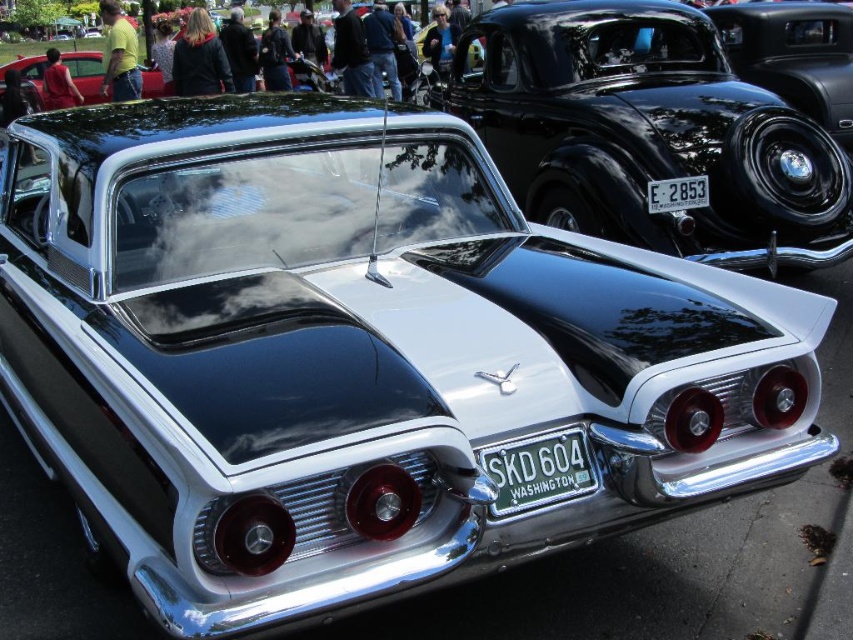
Question: Where is shiny black car at upper right located in relation to white plastic license plate at center in the image?

Choices:
 (A) below
 (B) above

Answer: (B)

Question: Can you confirm if green metallic license plate at center is smaller than white plastic license plate at center?

Choices:
 (A) no
 (B) yes

Answer: (A)

Question: Among these objects, which one is nearest to the camera?

Choices:
 (A) green metallic license plate at center
 (B) white plastic license plate at center
 (C) shiny black car at upper right

Answer: (A)

Question: Among these points, which one is nearest to the camera?

Choices:
 (A) (519, 460)
 (B) (682, 205)

Answer: (A)

Question: Which point appears closest to the camera in this image?

Choices:
 (A) pyautogui.click(x=538, y=449)
 (B) pyautogui.click(x=662, y=200)
 (C) pyautogui.click(x=668, y=72)

Answer: (A)

Question: Can you confirm if green metallic license plate at center is positioned to the right of white plastic license plate at center?

Choices:
 (A) yes
 (B) no

Answer: (B)